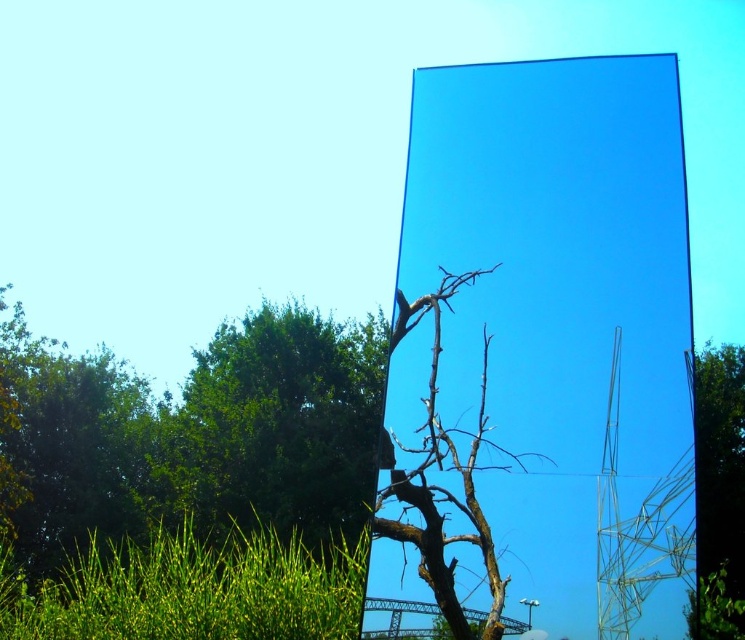
Question: Among these objects, which one is nearest to the camera?

Choices:
 (A) green leafy tree at right
 (B) green grass at lower left
 (C) brown matte tree at center
 (D) green leafy tree at lower left

Answer: (A)

Question: Does green leafy tree at lower left appear under green leafy tree at right?

Choices:
 (A) yes
 (B) no

Answer: (A)

Question: Which point is closer to the camera?

Choices:
 (A) green leafy tree at right
 (B) green grass at lower left
 (C) green leafy tree at lower left
 (D) brown matte tree at center

Answer: (A)

Question: In this image, where is green leafy tree at lower left located relative to brown matte tree at center?

Choices:
 (A) above
 (B) below

Answer: (B)

Question: From the image, what is the correct spatial relationship of green leafy tree at lower left in relation to brown matte tree at center?

Choices:
 (A) above
 (B) below

Answer: (B)

Question: Which of the following is the closest to the observer?

Choices:
 (A) (741, 388)
 (B) (139, 570)
 (C) (431, 531)
 (D) (259, 496)

Answer: (C)